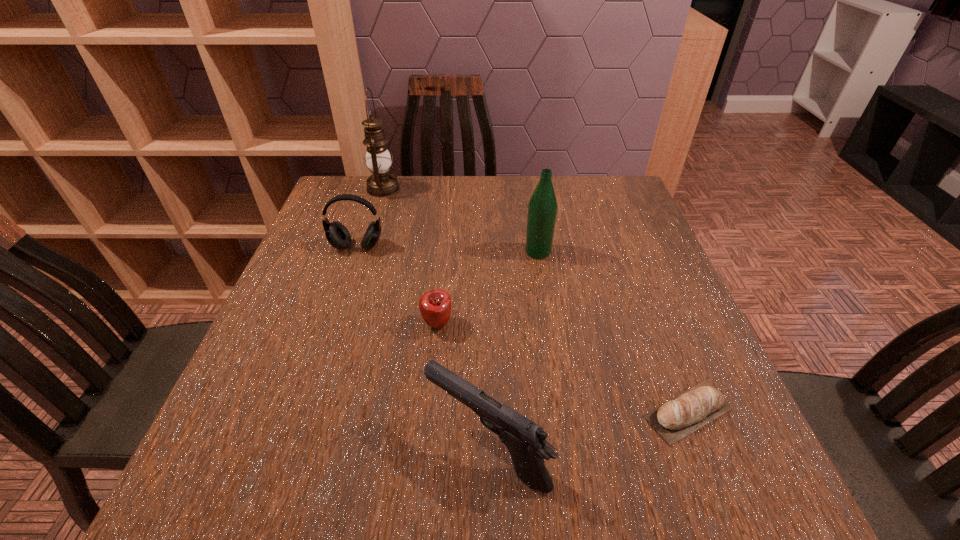
I want to click on oil lamp, so click(x=381, y=183).

Locate an element on the screen. This screenshot has width=960, height=540. the tallest object is located at coordinates (381, 183).

Where is `the second object from right to left`? This screenshot has height=540, width=960. the second object from right to left is located at coordinates (542, 208).

Identify the location of bottle. This screenshot has width=960, height=540. (542, 208).

Where is `headset`? This screenshot has width=960, height=540. headset is located at coordinates (337, 234).

The width and height of the screenshot is (960, 540). In order to click on gun in this screenshot , I will do `click(526, 441)`.

Where is `the second shortest object`? This screenshot has width=960, height=540. the second shortest object is located at coordinates (435, 306).

You are a GUI agent. You are given a task and a screenshot of the screen. Output one action in this format:
    pyautogui.click(x=<x>, y=<y>)
    Task: Click on the fourth farthest object
    The image size is (960, 540).
    Given the screenshot: What is the action you would take?
    pyautogui.click(x=435, y=306)

The image size is (960, 540). In order to click on the rightmost object in this screenshot , I will do `click(675, 419)`.

Where is `pita bread`? The height and width of the screenshot is (540, 960). pita bread is located at coordinates (675, 419).